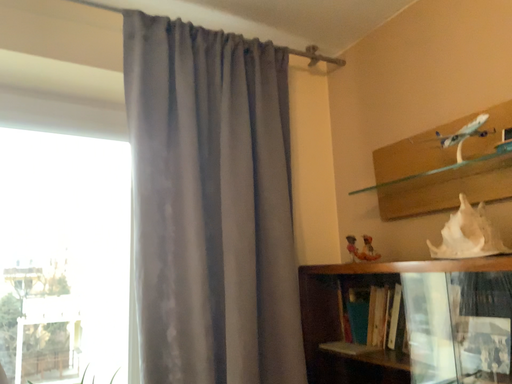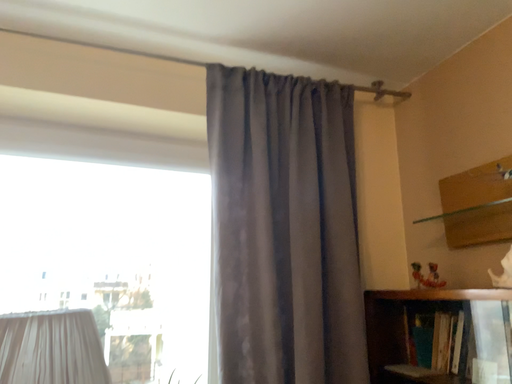
Question: How did the camera likely rotate when shooting the video?

Choices:
 (A) rotated right
 (B) rotated left

Answer: (B)